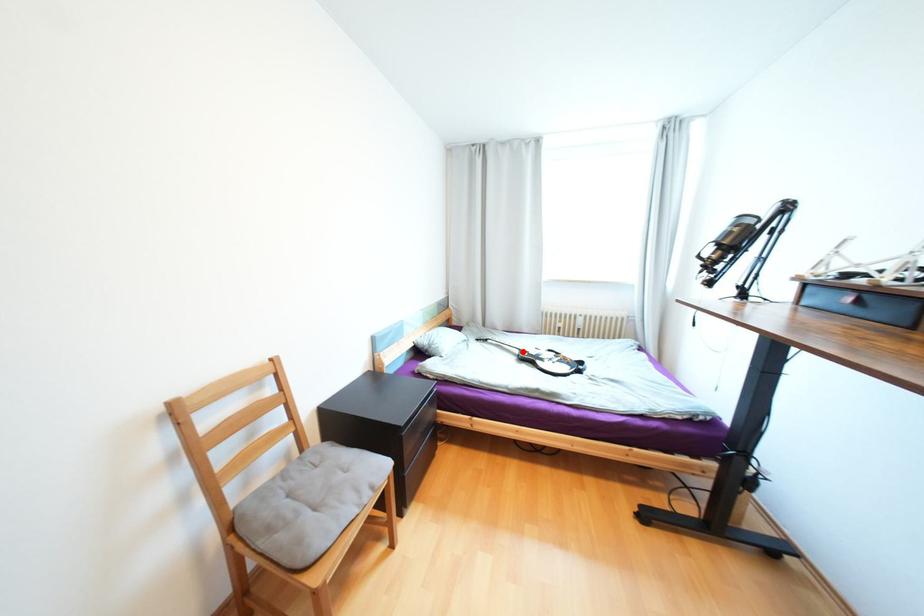
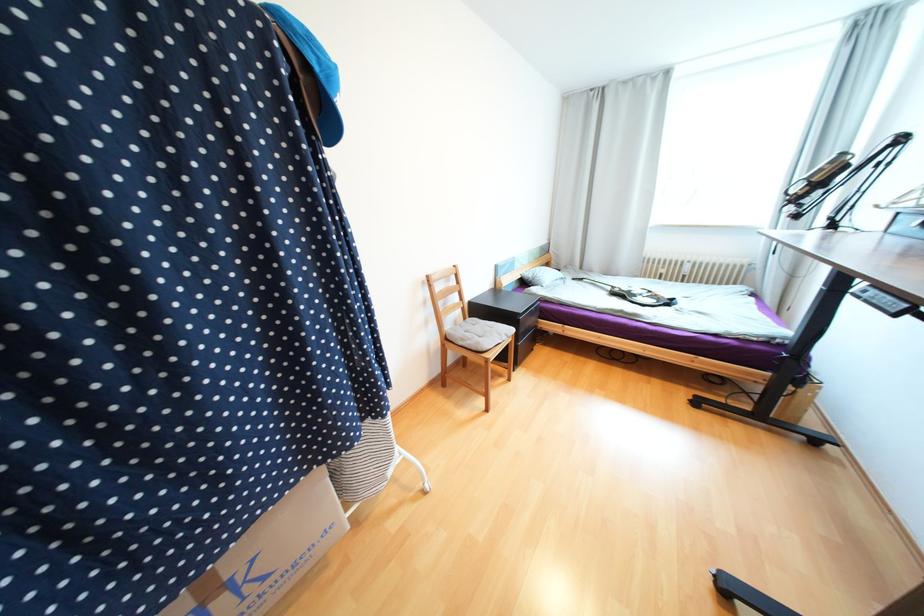
In the second image, find the point that corresponds to the highlighted location in the first image.

(614, 288)